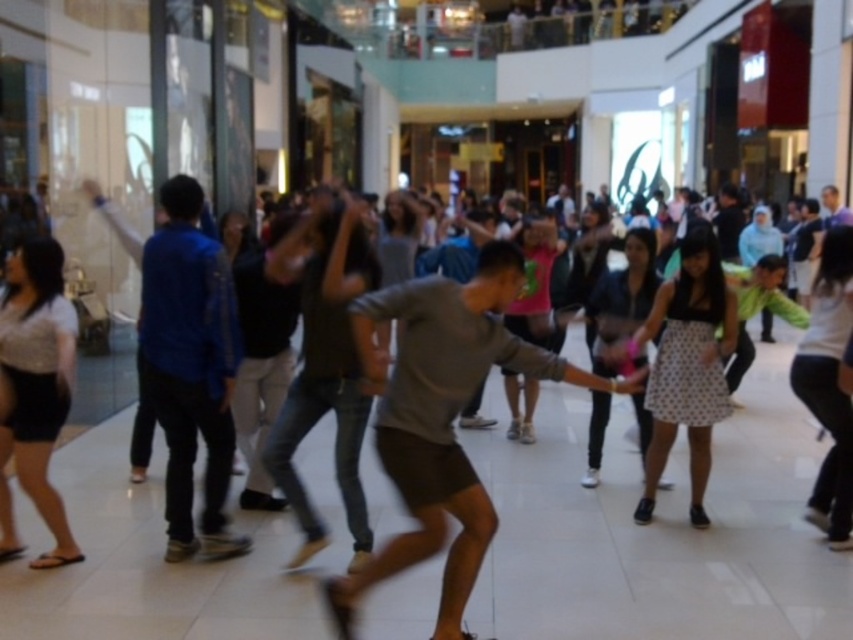
You are standing in the shopping mall and want to reach the point closer to you between point (x=473, y=288) and point (x=180, y=522). Which point should you head towards?

You should head towards point (x=473, y=288) because it is closer to the viewer than point (x=180, y=522).

You are a photographer standing at the back of the mall. You want to take a photo of the gray matte shirt at center and the blue cotton shirt at left. The camera requires a minimum distance of 1.5 meters between subjects to focus properly. Can you capture both subjects clearly in one shot?

The distance between the gray matte shirt at center and blue cotton shirt at left is 1.44 meters, which is less than the required 1.5 meters. Therefore, the camera cannot focus properly on both subjects simultaneously.